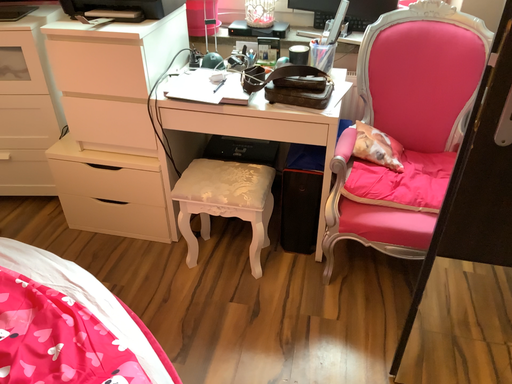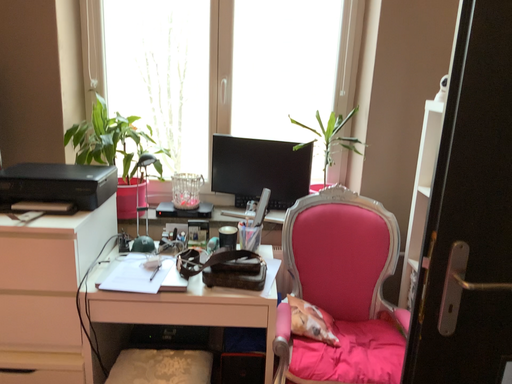
Question: Which way did the camera rotate in the video?

Choices:
 (A) rotated downward
 (B) rotated upward

Answer: (B)